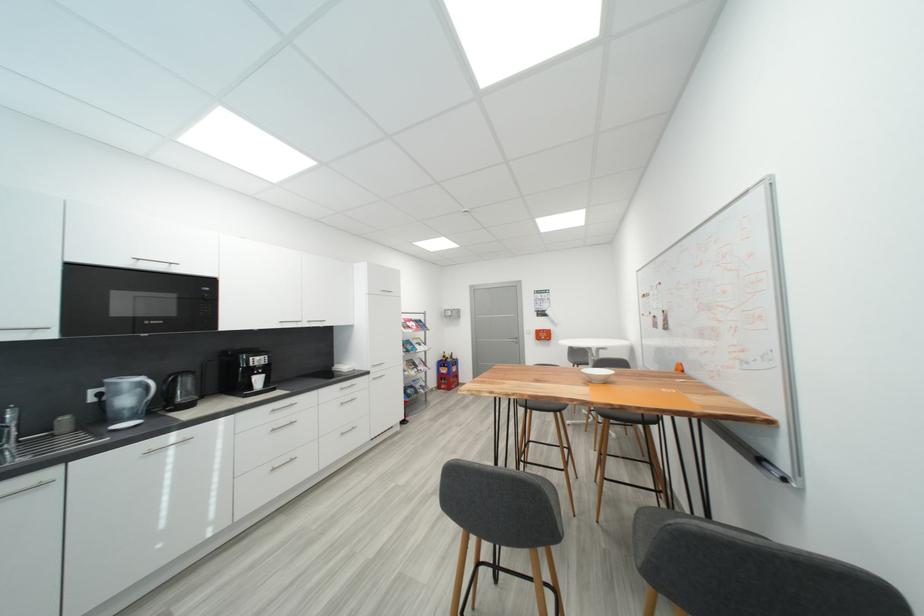
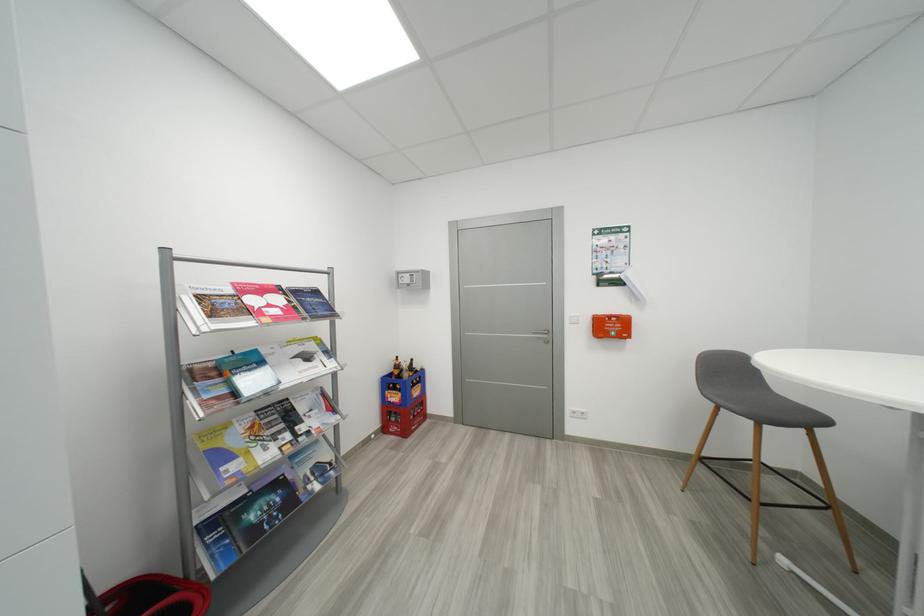
Where in the second image is the point corresponding to (x=551, y=338) from the first image?

(617, 330)